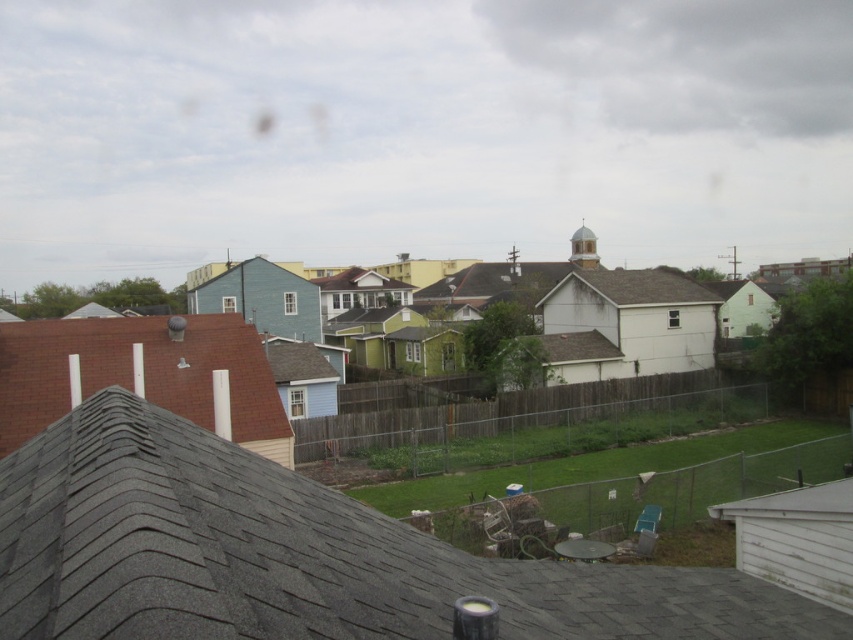
Question: From the image, what is the correct spatial relationship of gray shingles at center in relation to brown shingles at left?

Choices:
 (A) above
 (B) below

Answer: (B)

Question: Can you confirm if gray shingles at center is wider than brown shingles at left?

Choices:
 (A) yes
 (B) no

Answer: (B)

Question: Is gray shingles at center further to the viewer compared to brown shingles at left?

Choices:
 (A) yes
 (B) no

Answer: (B)

Question: Which object is closer to the camera taking this photo?

Choices:
 (A) brown shingles at left
 (B) gray shingles at center

Answer: (B)

Question: Among these points, which one is farthest from the camera?

Choices:
 (A) (646, 586)
 (B) (82, 394)

Answer: (B)